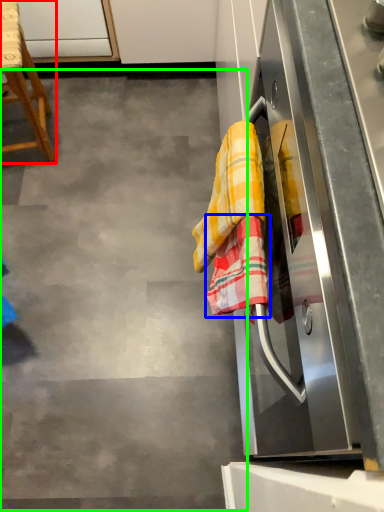
Question: Considering the real-world distances, which object is closest to furniture (highlighted by a red box)? beach towel (highlighted by a blue box) or concrete (highlighted by a green box).

Choices:
 (A) beach towel
 (B) concrete

Answer: (B)